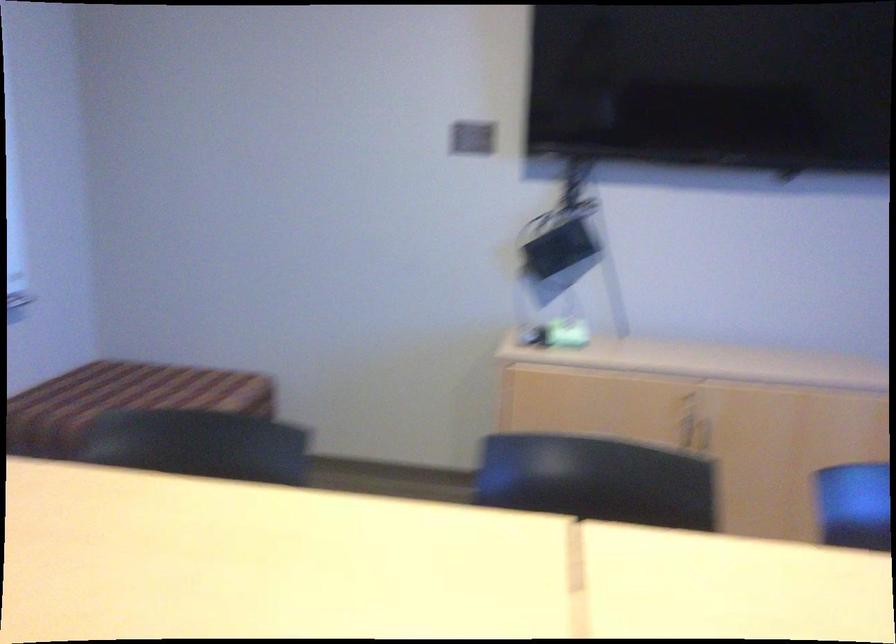
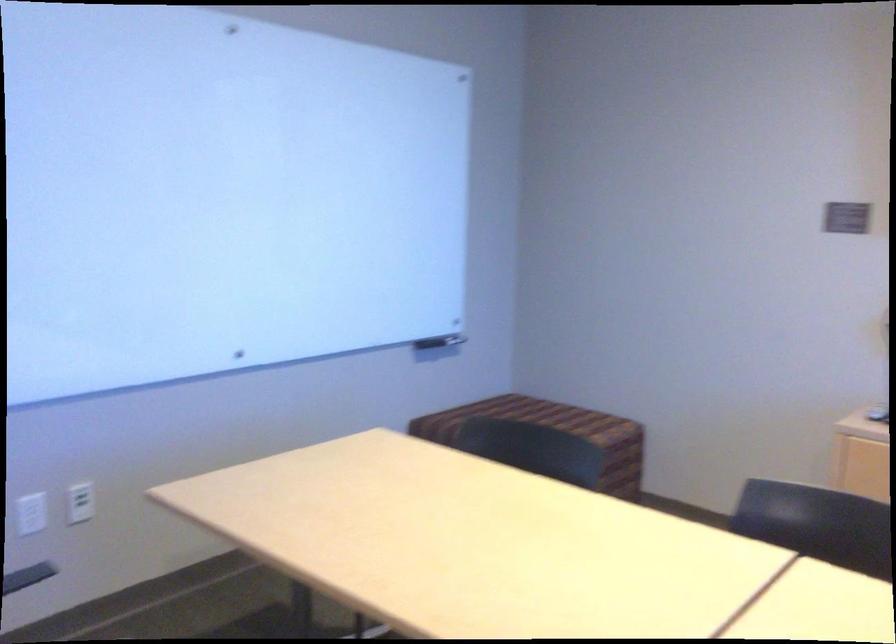
Question: The camera is either moving clockwise (left) or counter-clockwise (right) around the object. The first image is from the beginning of the video and the second image is from the end. Is the camera moving left or right when shooting the video?

Choices:
 (A) Left
 (B) Right

Answer: (B)